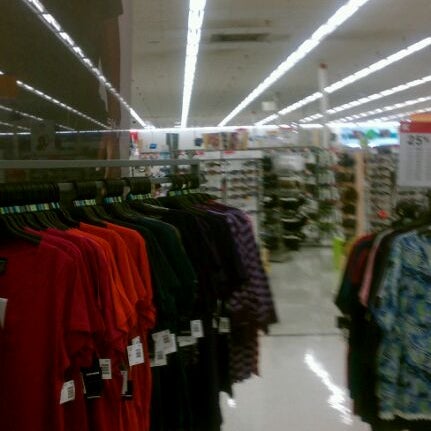
Locate an element on the screen. The width and height of the screenshot is (431, 431). shades is located at coordinates (234, 173).